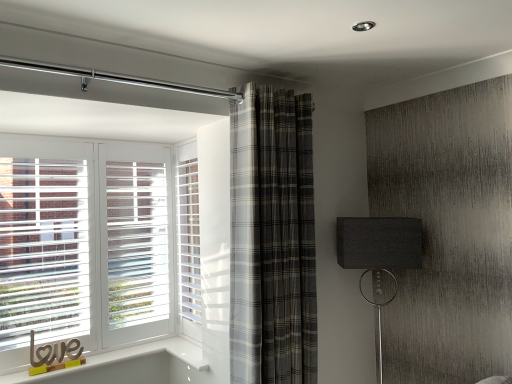
Measure the distance between point (271, 326) and camera.

A distance of 6.28 feet exists between point (271, 326) and camera.

Identify the location of plaid fabric curtain at center. The image size is (512, 384). (272, 239).

You are a GUI agent. You are given a task and a screenshot of the screen. Output one action in this format:
    pyautogui.click(x=<x>, y=<y>)
    Task: Click on the matte black lampshade at right
    
    Given the screenshot: What is the action you would take?
    pyautogui.click(x=379, y=253)

The image size is (512, 384). Find the location of `white textured screen door at center`. white textured screen door at center is located at coordinates (188, 240).

Where is `plaid fabric curtain at center`? plaid fabric curtain at center is located at coordinates (272, 239).

Looking at this image, do you think white textured screen door at center is within plaid fabric curtain at center, or outside of it?

white textured screen door at center cannot be found inside plaid fabric curtain at center.

Does point (182, 224) come closer to viewer compared to point (289, 252)?

No.

From a real-world perspective, is white textured screen door at center positioned above or below plaid fabric curtain at center?

From a real-world perspective, white textured screen door at center is physically below plaid fabric curtain at center.

How different are the orientations of white textured screen door at center and plaid fabric curtain at center in degrees?

The facing directions of white textured screen door at center and plaid fabric curtain at center are 87.5 degrees apart.

The width and height of the screenshot is (512, 384). What are the coordinates of `table lamp in front of the white textured screen door at center` in the screenshot? It's located at (379, 253).

How much distance is there between white textured screen door at center and matte black lampshade at right?

A distance of 1.00 meters exists between white textured screen door at center and matte black lampshade at right.

Can you confirm if white textured screen door at center is positioned to the right of matte black lampshade at right?

In fact, white textured screen door at center is to the left of matte black lampshade at right.

Considering the positions of objects plaid fabric curtain at center and matte black lampshade at right in the image provided, who is more to the left, plaid fabric curtain at center or matte black lampshade at right?

Positioned to the left is plaid fabric curtain at center.

Looking at this image, can you confirm if plaid fabric curtain at center is shorter than matte black lampshade at right?

No.

Measure the distance from plaid fabric curtain at center to matte black lampshade at right.

The distance of plaid fabric curtain at center from matte black lampshade at right is 20.37 inches.

Choose the correct answer: Is plaid fabric curtain at center inside matte black lampshade at right or outside it?

The correct answer is: outside.

Which of these two, matte black lampshade at right or white textured screen door at center, is bigger?

With larger size is matte black lampshade at right.

Considering the relative sizes of matte black lampshade at right and white textured screen door at center in the image provided, is matte black lampshade at right taller than white textured screen door at center?

No, matte black lampshade at right is not taller than white textured screen door at center.

How many degrees apart are the facing directions of matte black lampshade at right and white textured screen door at center?

52 degrees.

Is the surface of matte black lampshade at right in direct contact with white textured screen door at center?

There is a gap between matte black lampshade at right and white textured screen door at center.

From the image's perspective, would you say plaid fabric curtain at center is shown under white textured screen door at center?

No, from the image's perspective, plaid fabric curtain at center is not below white textured screen door at center.

Considering the positions of objects plaid fabric curtain at center and white textured screen door at center in the image provided, who is behind, plaid fabric curtain at center or white textured screen door at center?

white textured screen door at center.

From a real-world perspective, between plaid fabric curtain at center and white textured screen door at center, who is vertically higher?

plaid fabric curtain at center.

From the picture: Measure the distance between matte black lampshade at right and plaid fabric curtain at center.

20.37 inches.

From the picture: From the image's perspective, is matte black lampshade at right above or below plaid fabric curtain at center?

Clearly, from the image's perspective, matte black lampshade at right is below plaid fabric curtain at center.

From the picture: Considering the sizes of objects matte black lampshade at right and plaid fabric curtain at center in the image provided, who is wider, matte black lampshade at right or plaid fabric curtain at center?

Wider between the two is matte black lampshade at right.

Can you confirm if matte black lampshade at right is taller than plaid fabric curtain at center?

No, matte black lampshade at right is not taller than plaid fabric curtain at center.

Identify the location of curtain lying in front of the white textured screen door at center. (272, 239).

Where is `screen door lying behind the matte black lampshade at right`? The width and height of the screenshot is (512, 384). screen door lying behind the matte black lampshade at right is located at coordinates (188, 240).

From the image, which object appears to be farther from plaid fabric curtain at center, white textured screen door at center or matte black lampshade at right?

white textured screen door at center is positioned further to the anchor plaid fabric curtain at center.

Consider the image. Considering their positions, is plaid fabric curtain at center positioned further to white textured screen door at center than matte black lampshade at right?

The object further to white textured screen door at center is matte black lampshade at right.

When comparing their distances from white textured screen door at center, does matte black lampshade at right or plaid fabric curtain at center seem further?

Among the two, matte black lampshade at right is located further to white textured screen door at center.

Looking at the image, which one is located closer to plaid fabric curtain at center, matte black lampshade at right or white textured screen door at center?

matte black lampshade at right.

Looking at the image, which one is located further to matte black lampshade at right, white textured screen door at center or plaid fabric curtain at center?

white textured screen door at center lies further to matte black lampshade at right than the other object.

Based on their spatial positions, is plaid fabric curtain at center or white textured screen door at center further from matte black lampshade at right?

white textured screen door at center is positioned further to the anchor matte black lampshade at right.

The height and width of the screenshot is (384, 512). I want to click on curtain located between white textured screen door at center and matte black lampshade at right in the left-right direction, so click(x=272, y=239).